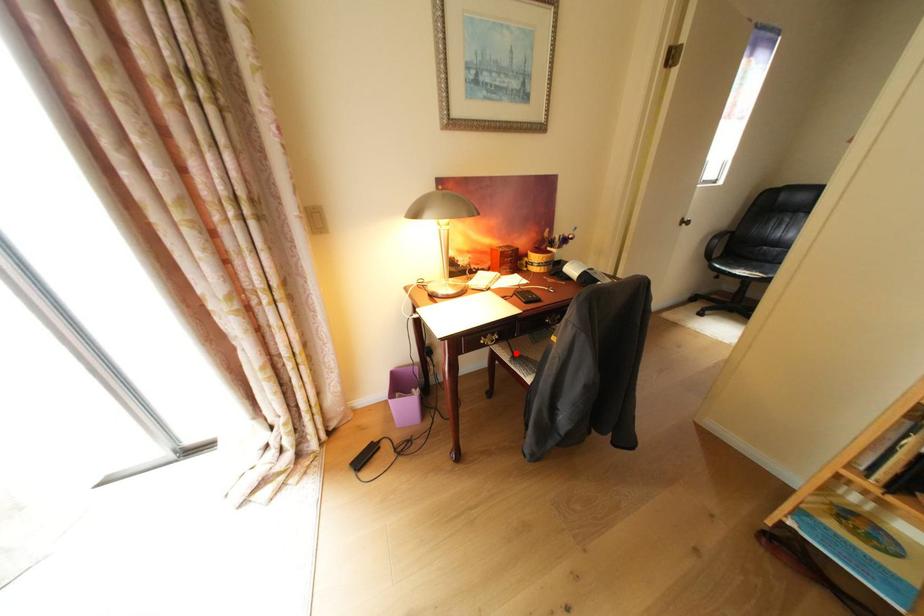
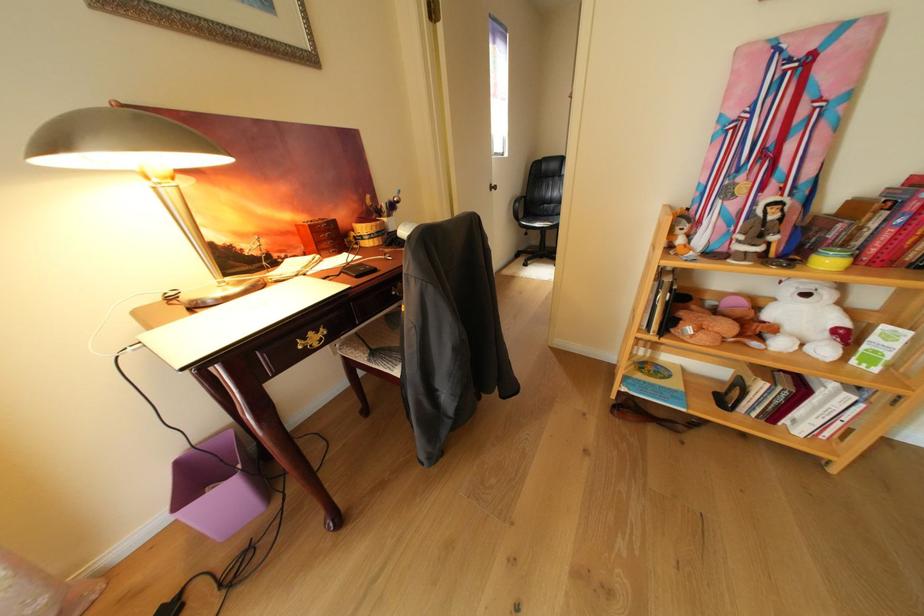
Question: I am providing you with two images of the same scene from different viewpoints. In image1, a red point is highlighted. Considering the same 3D point in image2, which of the following is correct?

Choices:
 (A) It is closer
 (B) It is farther

Answer: (A)